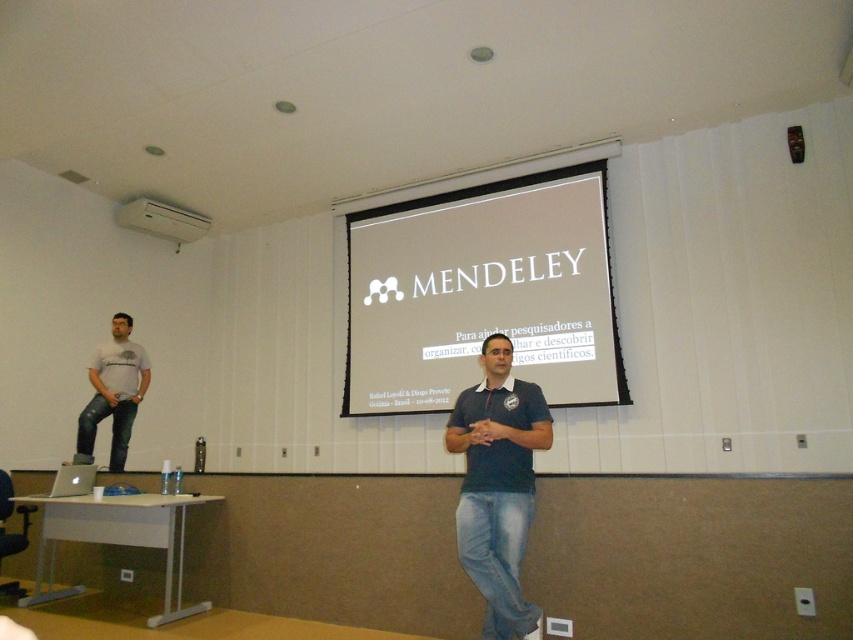
Question: Does dark blue shirt at center have a lesser width compared to matte white t-shirt at left?

Choices:
 (A) yes
 (B) no

Answer: (A)

Question: Which object appears farthest from the camera in this image?

Choices:
 (A) dark blue shirt at center
 (B) matte white t-shirt at left
 (C) white plastic projector at upper center

Answer: (C)

Question: Can you confirm if matte white t-shirt at left is wider than white plastic projector at upper center?

Choices:
 (A) no
 (B) yes

Answer: (A)

Question: Considering the relative positions of matte white t-shirt at left and white plastic projector at upper center in the image provided, where is matte white t-shirt at left located with respect to white plastic projector at upper center?

Choices:
 (A) right
 (B) left

Answer: (A)

Question: Which object is closer to the camera taking this photo?

Choices:
 (A) white matte projection screen at center
 (B) white plastic projector at upper center
 (C) matte white t-shirt at left
 (D) dark blue shirt at center

Answer: (D)

Question: Which point is farther from the camera taking this photo?

Choices:
 (A) (418, 202)
 (B) (155, 204)
 (C) (125, 417)
 (D) (519, 596)

Answer: (B)